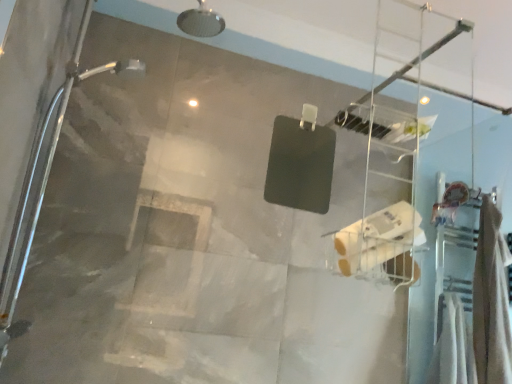
Question: Considering the positions of white matte toilet paper at center and clear plastic ladder at upper center in the image, is white matte toilet paper at center bigger or smaller than clear plastic ladder at upper center?

Choices:
 (A) small
 (B) big

Answer: (A)

Question: Considering their positions, is white matte toilet paper at center located in front of or behind clear plastic ladder at upper center?

Choices:
 (A) behind
 (B) front

Answer: (B)

Question: Estimate the real-world distances between objects in this image. Which object is closer to the beige fabric towel at right?

Choices:
 (A) white matte toilet paper at center
 (B) clear plastic ladder at upper center

Answer: (B)

Question: Which object is positioned closest to the clear plastic ladder at upper center?

Choices:
 (A) beige fabric towel at right
 (B) white matte toilet paper at center

Answer: (A)